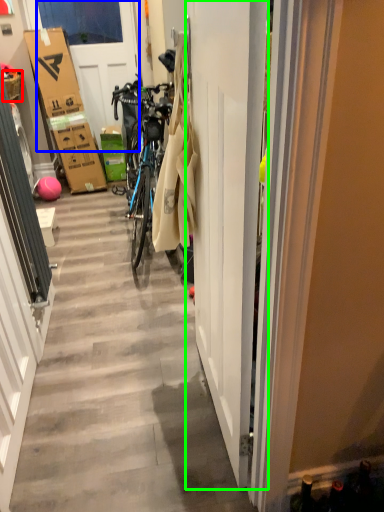
Question: Based on their relative distances, which object is farther from picnic basket (highlighted by a red box)? Choose from door (highlighted by a blue box) and door (highlighted by a green box).

Choices:
 (A) door
 (B) door

Answer: (A)